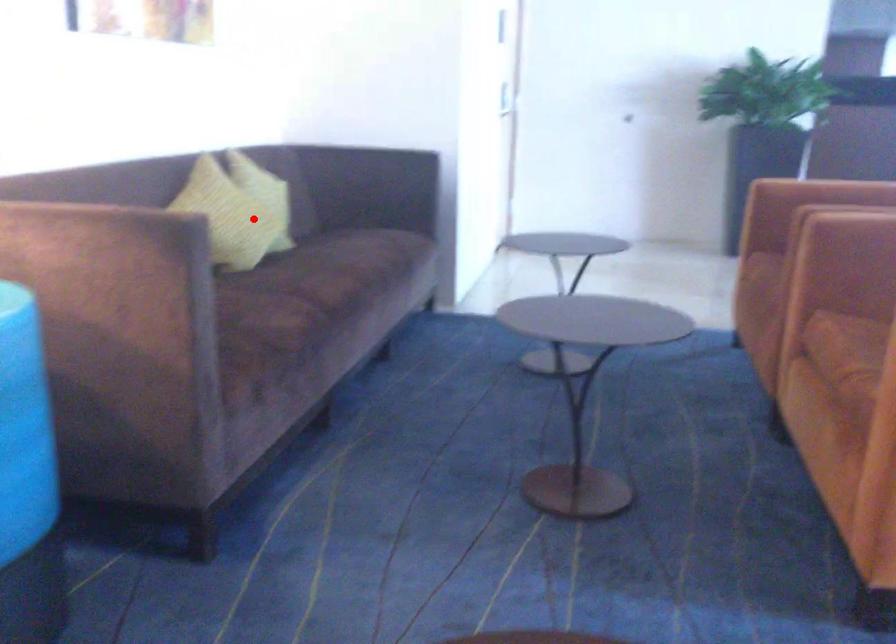
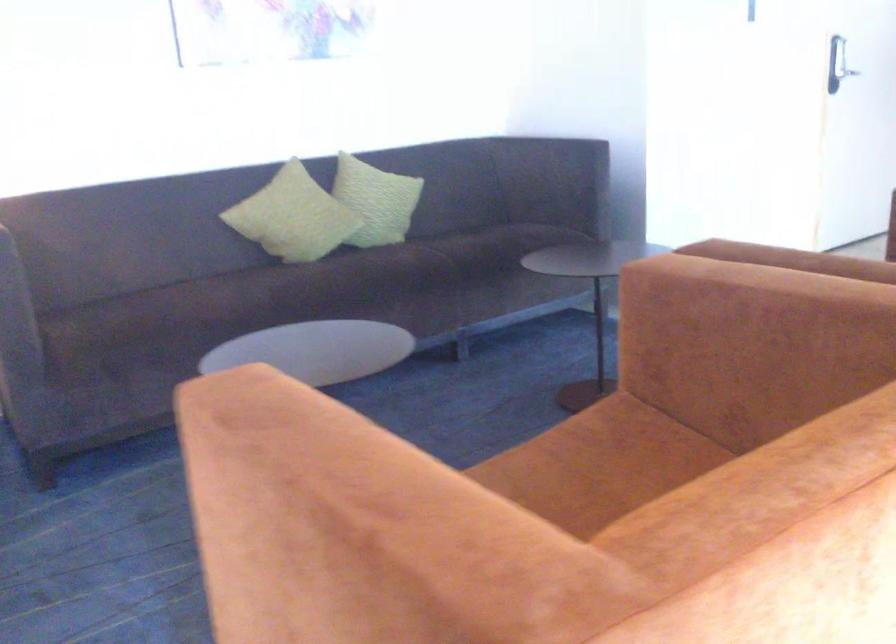
Question: A red point is marked in image1. In image2, is the corresponding 3D point closer to the camera or farther? Reply with the corresponding letter.

Choices:
 (A) The corresponding 3D point is closer.
 (B) The corresponding 3D point is farther.

Answer: (B)